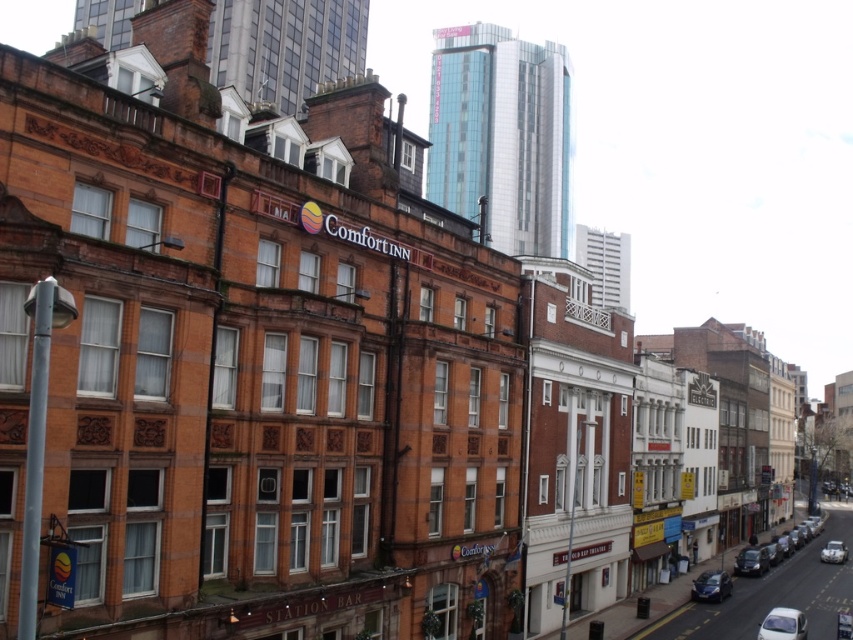
Which is above, shiny black car at lower right or silver metallic car at lower right?

shiny black car at lower right is higher up.

Does shiny black car at lower right have a smaller size compared to silver metallic car at lower right?

Yes.

Identify the location of shiny black car at lower right. (751, 561).

Is point (780, 612) behind point (831, 554)?

That is False.

Between white glossy car at lower right and silver metallic car at lower right, which one appears on the right side from the viewer's perspective?

From the viewer's perspective, silver metallic car at lower right appears more on the right side.

Who is more distant from viewer, (791, 614) or (828, 545)?

Positioned behind is point (828, 545).

At what (x,y) coordinates should I click in order to perform the action: click on white glossy car at lower right. Please return your answer as a coordinate pair (x, y). The height and width of the screenshot is (640, 853). Looking at the image, I should click on (782, 625).

Between point (764, 636) and point (715, 602), which one is positioned behind?

The point (715, 602) is more distant.

The width and height of the screenshot is (853, 640). Identify the location of white glossy car at lower right. (782, 625).

Identify the location of white glossy car at lower right. (782, 625).